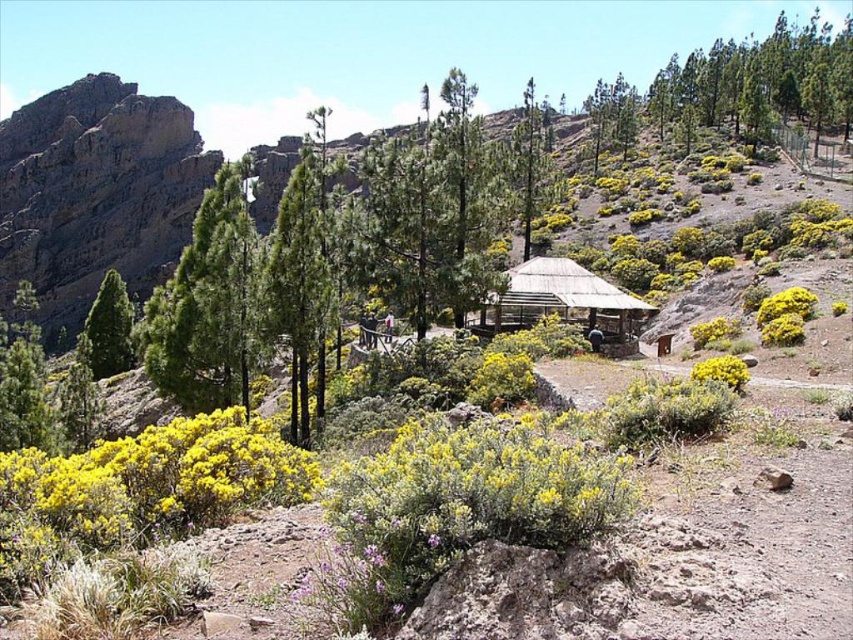
You are a hiker who wants to take a photo of the wooden thatched hut at center and the green glossy tree at upper left. From your current position, which object is closer to you?

The wooden thatched hut at center is closer to you because it is located below the green glossy tree at upper left, meaning it is positioned lower in the scene and thus nearer to the observer.

You are standing at the point marked as point (x=561, y=301) in the image. What structure do you see directly in front of you?

The wooden thatched hut at center is located directly in front of the point (x=561, y=301), so you would see the wooden thatched hut at center.